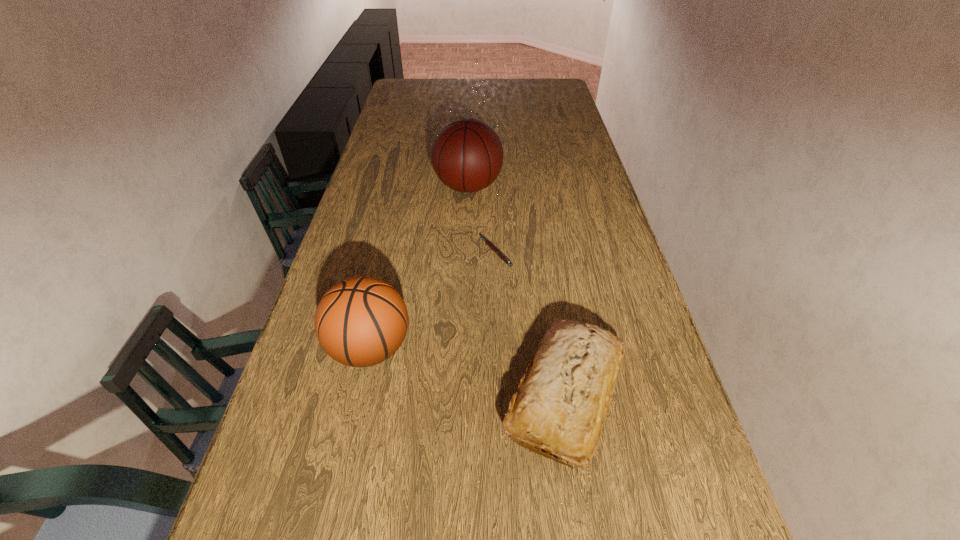
Locate an element on the screen. The width and height of the screenshot is (960, 540). blank area located 0.220m at the nib of the pen is located at coordinates (403, 252).

I want to click on vacant area located at the nib of the pen, so click(x=459, y=252).

Locate an element on the screen. Image resolution: width=960 pixels, height=540 pixels. vacant space located at the nib of the pen is located at coordinates (355, 252).

Find the location of a particular element. The image size is (960, 540). object that is at the left edge is located at coordinates (361, 321).

Where is `object located at the right edge`? The image size is (960, 540). object located at the right edge is located at coordinates (562, 400).

You are a GUI agent. You are given a task and a screenshot of the screen. Output one action in this format:
    pyautogui.click(x=<x>, y=<y>)
    Task: Click on the free space at the far edge of the desktop
    
    Given the screenshot: What is the action you would take?
    pyautogui.click(x=480, y=85)

In the image, there is a desktop. Where is `vacant space at the left edge`? vacant space at the left edge is located at coordinates (362, 178).

The width and height of the screenshot is (960, 540). I want to click on vacant space at the right edge, so click(582, 171).

Image resolution: width=960 pixels, height=540 pixels. In the image, there is a desktop. In order to click on blank space at the far left corner in this screenshot , I will do `click(397, 93)`.

Image resolution: width=960 pixels, height=540 pixels. Identify the location of vacant point at the far right corner. (549, 91).